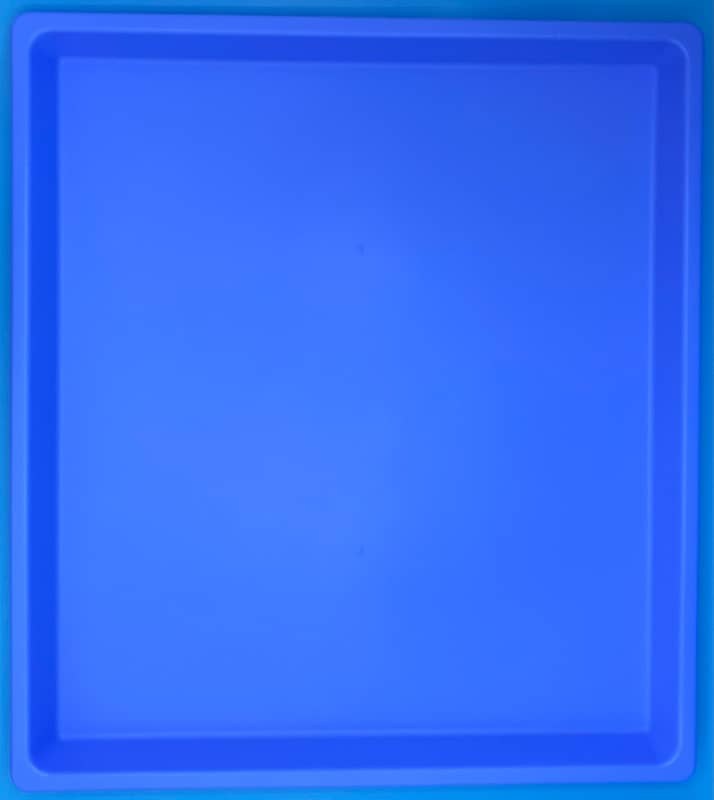
At what (x,y) coordinates should I click in order to perform the action: click on blue plastic tray. Please return your answer as a coordinate pair (x, y). Image resolution: width=714 pixels, height=800 pixels. Looking at the image, I should click on (315, 381).